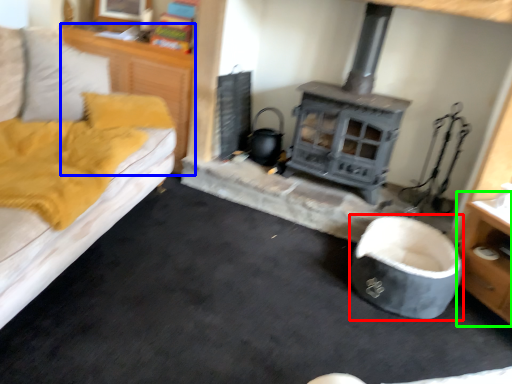
Question: Based on their relative distances, which object is nearer to bean bag chair (highlighted by a red box)? Choose from dresser (highlighted by a blue box) and dresser (highlighted by a green box).

Choices:
 (A) dresser
 (B) dresser

Answer: (B)